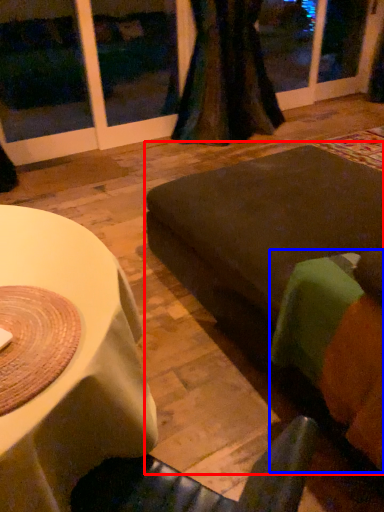
Question: Which of the following is the closest to the observer, couch (highlighted by a red box) or couch (highlighted by a blue box)?

Choices:
 (A) couch
 (B) couch

Answer: (B)